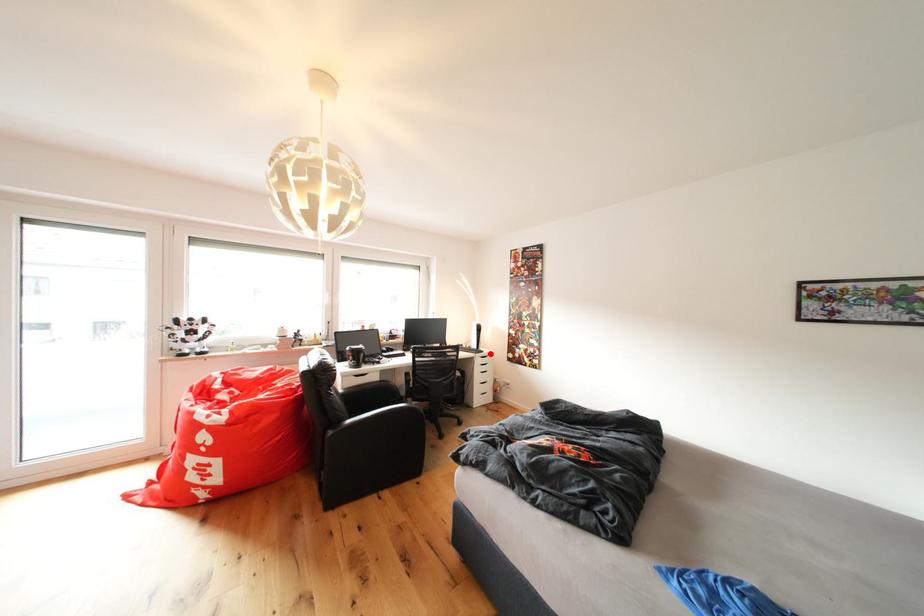
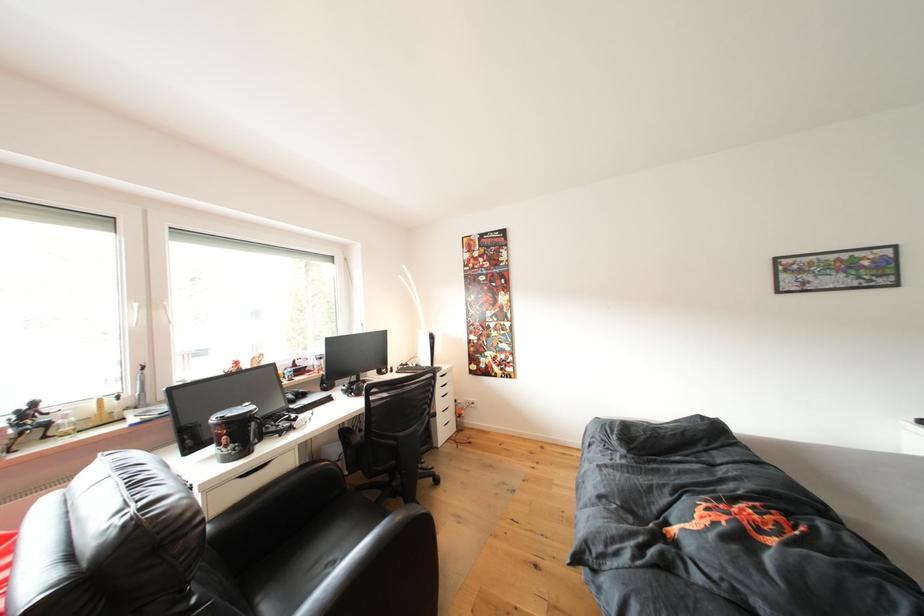
Question: A red point is marked in image1. In image2, is the corresponding 3D point closer to the camera or farther? Reply with the corresponding letter.

Choices:
 (A) The corresponding 3D point is closer.
 (B) The corresponding 3D point is farther.

Answer: (B)